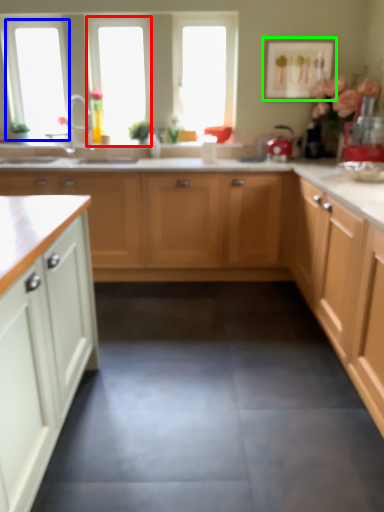
Question: Based on their relative distances, which object is nearer to window (highlighted by a red box)? Choose from window screen (highlighted by a blue box) and picture frame (highlighted by a green box).

Choices:
 (A) window screen
 (B) picture frame

Answer: (A)